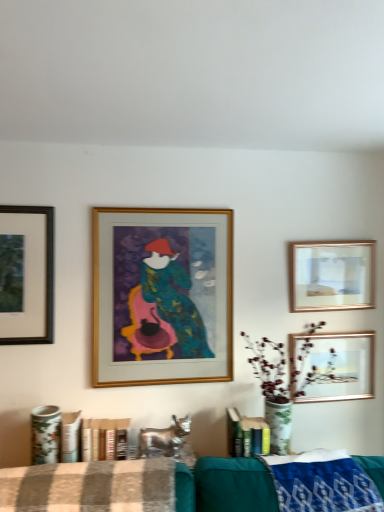
Image resolution: width=384 pixels, height=512 pixels. What do you see at coordinates (323, 485) in the screenshot?
I see `blue woven blanket at lower right` at bounding box center [323, 485].

What do you see at coordinates (162, 296) in the screenshot? I see `gold metallic picture frame at center, which is the third picture frame from right to left` at bounding box center [162, 296].

This screenshot has width=384, height=512. What do you see at coordinates (333, 275) in the screenshot?
I see `gold-framed picture at upper right, the third picture frame from the left` at bounding box center [333, 275].

Locate an element on the screen. The image size is (384, 512). blue woven blanket at lower right is located at coordinates click(323, 485).

From the picture: Which of these two, gold metallic picture frame at center, which ranks as the second picture frame in left-to-right order, or brown checkered fabric at lower center, stands shorter?

With less height is brown checkered fabric at lower center.

Is gold metallic picture frame at center, which is the third picture frame from right to left, facing towards brown checkered fabric at lower center?

No, gold metallic picture frame at center, which is the third picture frame from right to left, is not turned towards brown checkered fabric at lower center.

Considering the positions of points (206, 371) and (58, 507), is point (206, 371) farther from camera compared to point (58, 507)?

That is True.

Based on the photo, between gold metallic picture frame at center, which is the third picture frame from right to left, and brown checkered fabric at lower center, which one appears on the right side from the viewer's perspective?

gold metallic picture frame at center, which is the third picture frame from right to left, is more to the right.

Does brown checkered fabric at lower center have a greater height compared to blue woven blanket at lower right?

Incorrect, the height of brown checkered fabric at lower center is not larger of that of blue woven blanket at lower right.

Looking at this image, considering the relative positions of brown checkered fabric at lower center and blue woven blanket at lower right in the image provided, is brown checkered fabric at lower center to the left or to the right of blue woven blanket at lower right?

brown checkered fabric at lower center is to the left of blue woven blanket at lower right.

Does point (22, 474) come closer to viewer compared to point (367, 473)?

Yes, it is in front of point (367, 473).

Is brown checkered fabric at lower center not within blue woven blanket at lower right?

Yes, brown checkered fabric at lower center is located beyond the bounds of blue woven blanket at lower right.

From a real-world perspective, which object stands above the other?

From a 3D spatial view, matte black frame at upper left, which is the 1th picture frame in left-to-right order, is above.

Is point (134, 286) farther from viewer compared to point (17, 246)?

Yes, it is behind point (17, 246).

How much distance is there between gold metallic picture frame at center, which is the third picture frame from right to left, and matte black frame at upper left, which is the 1th picture frame in left-to-right order?

gold metallic picture frame at center, which is the third picture frame from right to left, and matte black frame at upper left, which is the 1th picture frame in left-to-right order, are 45.14 centimeters apart from each other.

Is gold metallic picture frame at center, which is the third picture frame from right to left, looking in the opposite direction of matte black frame at upper left, which is the 1th picture frame in left-to-right order?

No, gold metallic picture frame at center, which is the third picture frame from right to left, is not facing the opposite direction of matte black frame at upper left, which is the 1th picture frame in left-to-right order.

How distant is blue woven blanket at lower right from gold metallic picture frame at center, which is the third picture frame from right to left?

blue woven blanket at lower right and gold metallic picture frame at center, which is the third picture frame from right to left, are 30.63 inches apart.

Is gold metallic picture frame at center, which is the third picture frame from right to left, completely or partially inside blue woven blanket at lower right?

Definitely not — gold metallic picture frame at center, which is the third picture frame from right to left, is not inside blue woven blanket at lower right.

Which of these two, blue woven blanket at lower right or gold metallic picture frame at center, which ranks as the second picture frame in left-to-right order, stands shorter?

Standing shorter between the two is blue woven blanket at lower right.

Is blue woven blanket at lower right facing away from gold metallic picture frame at center, which is the third picture frame from right to left?

No, blue woven blanket at lower right is not facing away from gold metallic picture frame at center, which is the third picture frame from right to left.

From a real-world perspective, between matte black frame at upper left, which is the 1th picture frame in left-to-right order, and gold-framed picture at upper right, the second picture frame when ordered from right to left, who is vertically higher?

From a 3D spatial view, matte black frame at upper left, which is the 1th picture frame in left-to-right order, is above.

Is the depth of matte black frame at upper left, placed as the 4th picture frame when sorted from right to left, greater than that of gold-framed picture at upper right, the second picture frame when ordered from right to left?

No, it is in front of gold-framed picture at upper right, the second picture frame when ordered from right to left.

From the image's perspective, between matte black frame at upper left, which is the 1th picture frame in left-to-right order, and gold-framed picture at upper right, the second picture frame when ordered from right to left, which one is located above?

matte black frame at upper left, which is the 1th picture frame in left-to-right order, from the image's perspective.

Measure the distance between matte black frame at upper left, which is the 1th picture frame in left-to-right order, and gold-framed picture at upper right, the second picture frame when ordered from right to left.

They are 4.43 feet apart.

Consider the image. Is matte black frame at upper left, which is the 1th picture frame in left-to-right order, not close to blue woven blanket at lower right?

Yes, matte black frame at upper left, which is the 1th picture frame in left-to-right order, is far from blue woven blanket at lower right.

From the image's perspective, is matte black frame at upper left, which is the 1th picture frame in left-to-right order, located above or below blue woven blanket at lower right?

Based on their image positions, matte black frame at upper left, which is the 1th picture frame in left-to-right order, is located above blue woven blanket at lower right.

Is matte black frame at upper left, which is the 1th picture frame in left-to-right order, aimed at blue woven blanket at lower right?

No, matte black frame at upper left, which is the 1th picture frame in left-to-right order, does not turn towards blue woven blanket at lower right.

In the scene shown: Would you say matte black frame at upper left, which is the 1th picture frame in left-to-right order, is outside blue woven blanket at lower right?

Yes.

From the image's perspective, between metallic gold picture frame at upper right, the 1th picture frame when ordered from right to left, and blue woven blanket at lower right, who is located below?

blue woven blanket at lower right, from the image's perspective.

How distant is metallic gold picture frame at upper right, the 1th picture frame when ordered from right to left, from blue woven blanket at lower right?

metallic gold picture frame at upper right, the 1th picture frame when ordered from right to left, and blue woven blanket at lower right are 56.82 centimeters apart.

Do you think metallic gold picture frame at upper right, placed as the 4th picture frame when sorted from left to right, is within blue woven blanket at lower right, or outside of it?

metallic gold picture frame at upper right, placed as the 4th picture frame when sorted from left to right, is spatially situated outside blue woven blanket at lower right.

Can you confirm if metallic gold picture frame at upper right, placed as the 4th picture frame when sorted from left to right, is taller than blue woven blanket at lower right?

Correct, metallic gold picture frame at upper right, placed as the 4th picture frame when sorted from left to right, is much taller as blue woven blanket at lower right.

I want to click on bedding below the gold metallic picture frame at center, which ranks as the second picture frame in left-to-right order (from a real-world perspective), so click(x=90, y=487).

This screenshot has height=512, width=384. I want to click on cloth located behind the brown checkered fabric at lower center, so click(323, 485).

Based on their spatial positions, is gold metallic picture frame at center, which is the third picture frame from right to left, or metallic gold picture frame at upper right, placed as the 4th picture frame when sorted from left to right, closer to blue woven blanket at lower right?

metallic gold picture frame at upper right, placed as the 4th picture frame when sorted from left to right, lies closer to blue woven blanket at lower right than the other object.

Considering their positions, is gold-framed picture at upper right, the third picture frame from the left, positioned further to metallic gold picture frame at upper right, the 1th picture frame when ordered from right to left, than matte black frame at upper left, placed as the 4th picture frame when sorted from right to left?

Among the two, matte black frame at upper left, placed as the 4th picture frame when sorted from right to left, is located further to metallic gold picture frame at upper right, the 1th picture frame when ordered from right to left.

Looking at the image, which one is located closer to gold metallic picture frame at center, which is the third picture frame from right to left, gold-framed picture at upper right, the second picture frame when ordered from right to left, or blue woven blanket at lower right?

gold-framed picture at upper right, the second picture frame when ordered from right to left, is closer to gold metallic picture frame at center, which is the third picture frame from right to left.

From the image, which object appears to be nearer to gold metallic picture frame at center, which is the third picture frame from right to left, metallic gold picture frame at upper right, placed as the 4th picture frame when sorted from left to right, or gold-framed picture at upper right, the third picture frame from the left?

gold-framed picture at upper right, the third picture frame from the left, is positioned closer to the anchor gold metallic picture frame at center, which is the third picture frame from right to left.

Looking at this image, which object lies nearer to the anchor point blue woven blanket at lower right, gold-framed picture at upper right, the second picture frame when ordered from right to left, or metallic gold picture frame at upper right, the 1th picture frame when ordered from right to left?

Among the two, metallic gold picture frame at upper right, the 1th picture frame when ordered from right to left, is located nearer to blue woven blanket at lower right.

Which object lies further to the anchor point matte black frame at upper left, placed as the 4th picture frame when sorted from right to left, blue woven blanket at lower right or brown checkered fabric at lower center?

blue woven blanket at lower right is positioned further to the anchor matte black frame at upper left, placed as the 4th picture frame when sorted from right to left.

Looking at the image, which one is located closer to blue woven blanket at lower right, matte black frame at upper left, placed as the 4th picture frame when sorted from right to left, or gold-framed picture at upper right, the third picture frame from the left?

The object closer to blue woven blanket at lower right is gold-framed picture at upper right, the third picture frame from the left.

Which object lies further to the anchor point brown checkered fabric at lower center, gold metallic picture frame at center, which ranks as the second picture frame in left-to-right order, or metallic gold picture frame at upper right, the 1th picture frame when ordered from right to left?

Among the two, metallic gold picture frame at upper right, the 1th picture frame when ordered from right to left, is located further to brown checkered fabric at lower center.

The height and width of the screenshot is (512, 384). I want to click on bedding between matte black frame at upper left, placed as the 4th picture frame when sorted from right to left, and blue woven blanket at lower right, in the horizontal direction, so click(x=90, y=487).

Image resolution: width=384 pixels, height=512 pixels. Identify the location of picture frame located between brown checkered fabric at lower center and blue woven blanket at lower right in the left-right direction. (162, 296).

Find the location of a particular element. This screenshot has height=512, width=384. cloth located between brown checkered fabric at lower center and gold-framed picture at upper right, the third picture frame from the left, in the left-right direction is located at coordinates (323, 485).

Find the location of a particular element. cloth between matte black frame at upper left, placed as the 4th picture frame when sorted from right to left, and metallic gold picture frame at upper right, the 1th picture frame when ordered from right to left is located at coordinates (323, 485).